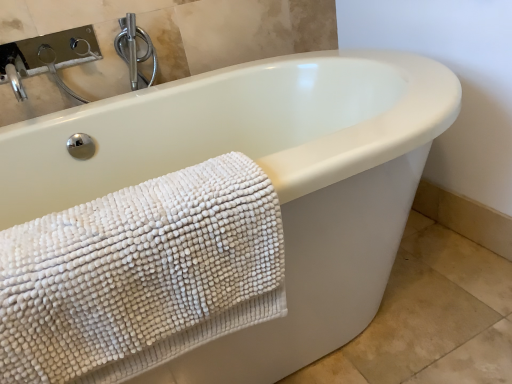
Question: Should I look upward or downward to see satin nickel faucet at upper left?

Choices:
 (A) up
 (B) down

Answer: (A)

Question: Considering the relative sizes of satin nickel faucet at upper left and white chenille towel at lower left in the image provided, is satin nickel faucet at upper left shorter than white chenille towel at lower left?

Choices:
 (A) no
 (B) yes

Answer: (B)

Question: Is satin nickel faucet at upper left far from white chenille towel at lower left?

Choices:
 (A) no
 (B) yes

Answer: (A)

Question: Is satin nickel faucet at upper left at the right side of white chenille towel at lower left?

Choices:
 (A) yes
 (B) no

Answer: (B)

Question: Is the depth of satin nickel faucet at upper left less than that of white chenille towel at lower left?

Choices:
 (A) no
 (B) yes

Answer: (A)

Question: Can we say satin nickel faucet at upper left lies outside white chenille towel at lower left?

Choices:
 (A) no
 (B) yes

Answer: (B)

Question: Considering the relative sizes of satin nickel faucet at upper left and white chenille towel at lower left in the image provided, is satin nickel faucet at upper left bigger than white chenille towel at lower left?

Choices:
 (A) no
 (B) yes

Answer: (A)

Question: From a real-world perspective, is white chenille towel at lower left on top of satin nickel faucet at upper left?

Choices:
 (A) yes
 (B) no

Answer: (B)

Question: Does white chenille towel at lower left appear on the right side of satin nickel faucet at upper left?

Choices:
 (A) yes
 (B) no

Answer: (A)

Question: Is white chenille towel at lower left positioned with its back to satin nickel faucet at upper left?

Choices:
 (A) no
 (B) yes

Answer: (B)

Question: Is white chenille towel at lower left beside satin nickel faucet at upper left?

Choices:
 (A) yes
 (B) no

Answer: (B)

Question: Considering the relative sizes of white chenille towel at lower left and satin nickel faucet at upper left in the image provided, is white chenille towel at lower left shorter than satin nickel faucet at upper left?

Choices:
 (A) yes
 (B) no

Answer: (B)

Question: Does white chenille towel at lower left turn towards satin nickel faucet at upper left?

Choices:
 (A) no
 (B) yes

Answer: (A)

Question: Is white chenille towel at lower left in front of or behind satin nickel faucet at upper left in the image?

Choices:
 (A) front
 (B) behind

Answer: (A)